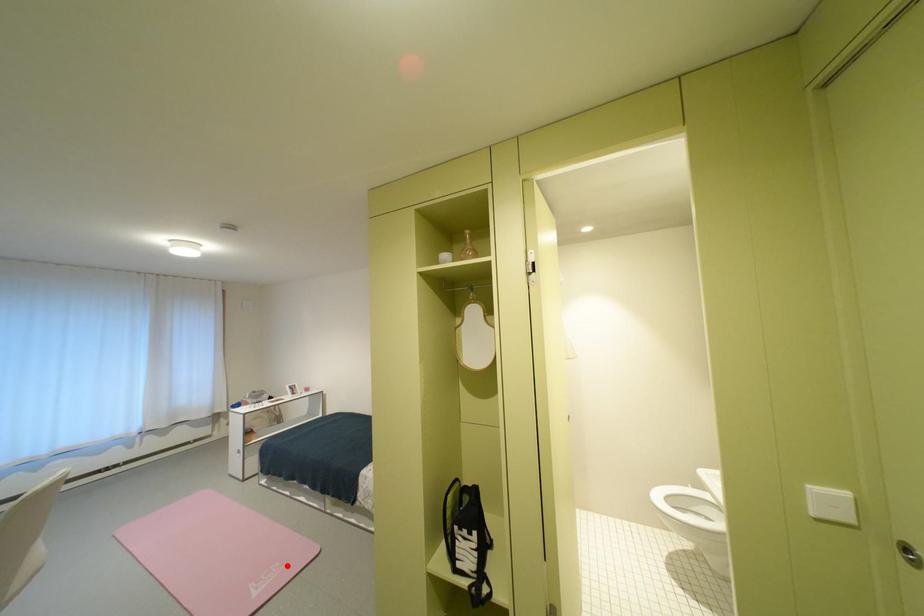
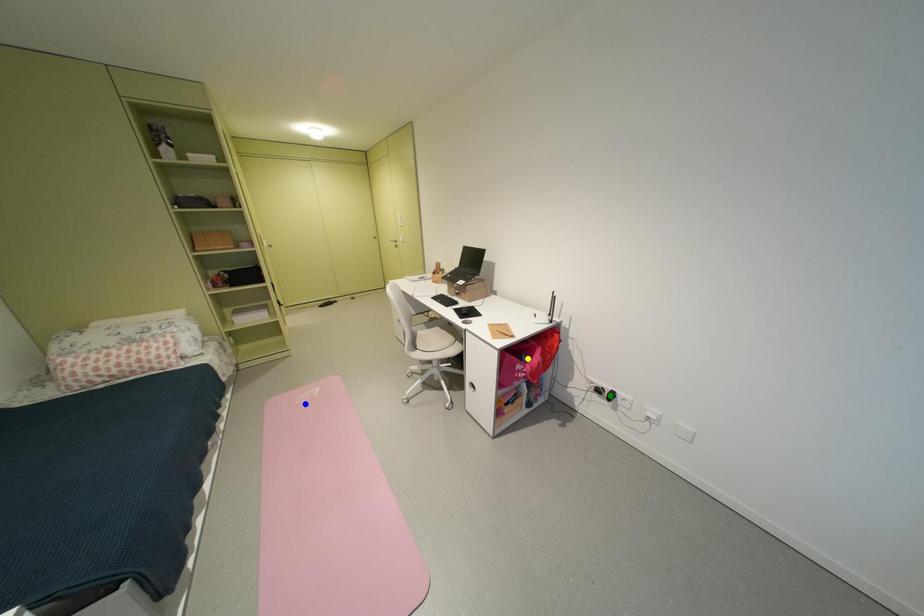
Question: I am providing you with two images of the same scene from different viewpoints. A red point is marked on the first image. You are given multiple points on the second image. Which mark in image 2 goes with the point in image 1?

Choices:
 (A) green point
 (B) yellow point
 (C) blue point

Answer: (C)